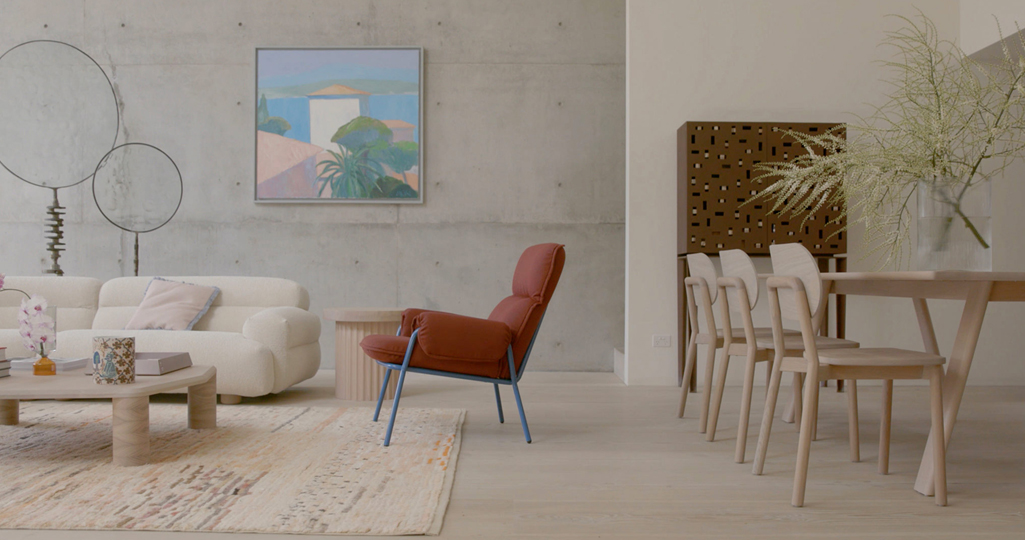
Identify the location of left armrest. (287, 327).